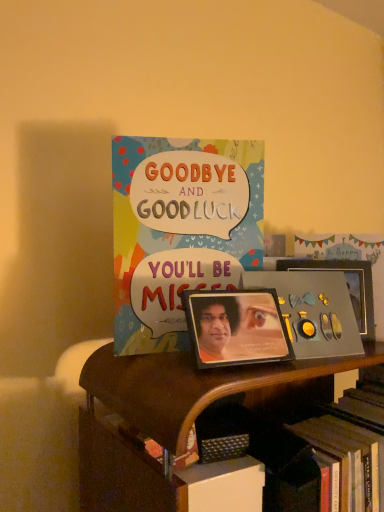
Question: Visually, is metallic photo frame at center, the 2th picture frame when ordered from back to front, positioned to the left or to the right of wooden bookcase at center?

Choices:
 (A) left
 (B) right

Answer: (A)

Question: Considering the positions of point pos(271,354) and point pos(314,370), is point pos(271,354) closer or farther from the camera than point pos(314,370)?

Choices:
 (A) closer
 (B) farther

Answer: (B)

Question: Which object is the closest to the colorful paper card at upper center?

Choices:
 (A) metallic silver album cover at center
 (B) wooden bookcase at center
 (C) metallic photo frame at center, which is the 1th picture frame in front-to-back order
 (D) metallic silver picture frame at center-right, the first picture frame viewed from the back

Answer: (C)

Question: Considering the real-world distances, which object is farthest from the metallic photo frame at center, the second picture frame in the right-to-left sequence?

Choices:
 (A) metallic silver picture frame at center-right, which is the 2th picture frame from left to right
 (B) metallic silver album cover at center
 (C) wooden bookcase at center
 (D) colorful paper card at upper center

Answer: (A)